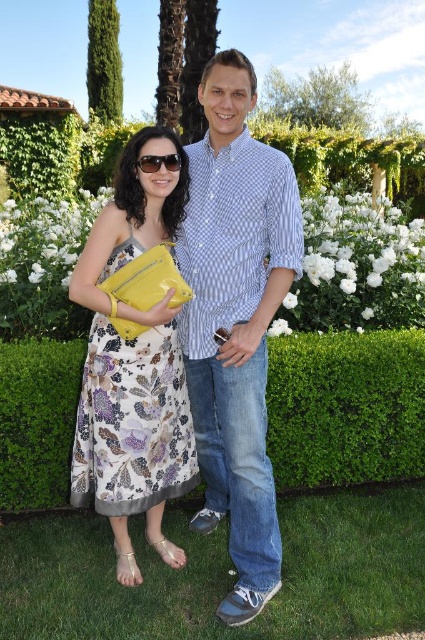
Based on the photo, between green grass at lower center and green leafy hedge at center, which one has more height?

green leafy hedge at center

Is green grass at lower center positioned at the back of green leafy hedge at center?

No, green grass at lower center is in front of green leafy hedge at center.

What do you see at coordinates (223, 573) in the screenshot? This screenshot has width=425, height=640. I see `green grass at lower center` at bounding box center [223, 573].

This screenshot has height=640, width=425. I want to click on green grass at lower center, so click(223, 573).

Is blue checkered shirt at center below printed silk dress at center?

No.

Find the location of `blue checkered shirt at center`. blue checkered shirt at center is located at coordinates (235, 321).

Between green grass at lower center and shiny black sunglasses at center, which one is positioned lower?

green grass at lower center

Can you confirm if green grass at lower center is bigger than shiny black sunglasses at center?

Correct, green grass at lower center is larger in size than shiny black sunglasses at center.

You are a GUI agent. You are given a task and a screenshot of the screen. Output one action in this format:
    pyautogui.click(x=<x>, y=<y>)
    Task: Click on the green grass at lower center
    Image resolution: width=425 pixels, height=640 pixels.
    Given the screenshot: What is the action you would take?
    pyautogui.click(x=223, y=573)